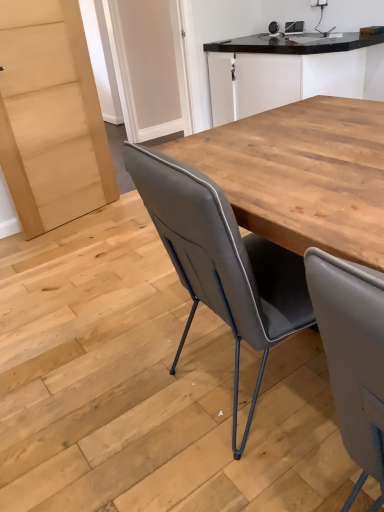
Question: Would you say black granite countertop at upper center is to the left or to the right of matte gray leather chair at center in the picture?

Choices:
 (A) right
 (B) left

Answer: (A)

Question: From a real-world perspective, is black granite countertop at upper center positioned above or below matte gray leather chair at center?

Choices:
 (A) below
 (B) above

Answer: (B)

Question: Looking at their shapes, would you say black granite countertop at upper center is wider or thinner than matte gray leather chair at center?

Choices:
 (A) thin
 (B) wide

Answer: (A)

Question: Is matte gray leather chair at center bigger or smaller than black granite countertop at upper center?

Choices:
 (A) small
 (B) big

Answer: (A)

Question: Looking at their shapes, would you say matte gray leather chair at center is wider or thinner than black granite countertop at upper center?

Choices:
 (A) wide
 (B) thin

Answer: (A)

Question: From a real-world perspective, is matte gray leather chair at center positioned above or below black granite countertop at upper center?

Choices:
 (A) above
 (B) below

Answer: (B)

Question: Is point (264, 352) closer or farther from the camera than point (360, 74)?

Choices:
 (A) closer
 (B) farther

Answer: (A)